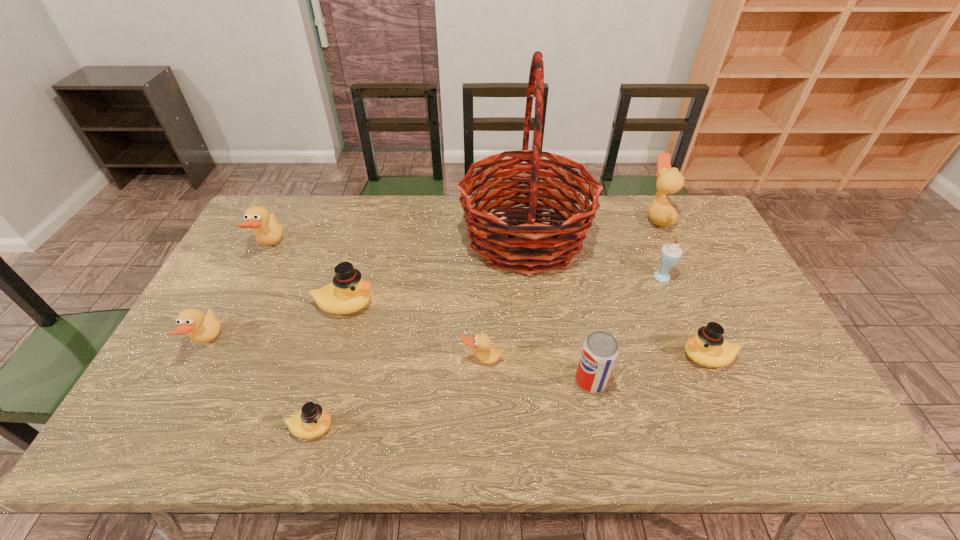
At what (x,y) coordinates should I click in order to perform the action: click on free space located 0.080m on the front-facing side of the nearest object. Please return your answer as a coordinate pair (x, y). Looking at the image, I should click on (370, 427).

Where is `basket at the far edge`? This screenshot has width=960, height=540. basket at the far edge is located at coordinates (535, 247).

You are a GUI agent. You are given a task and a screenshot of the screen. Output one action in this format:
    pyautogui.click(x=<x>, y=<y>)
    Task: Click on the object present at the near edge
    Image resolution: width=960 pixels, height=540 pixels.
    Given the screenshot: What is the action you would take?
    pyautogui.click(x=311, y=422)

The width and height of the screenshot is (960, 540). I want to click on object positioned at the far left corner, so click(264, 225).

Where is `object located in the far right corner section of the desktop`? This screenshot has width=960, height=540. object located in the far right corner section of the desktop is located at coordinates [x=669, y=180].

What are the coordinates of `vacant space at the far edge` in the screenshot? It's located at (659, 234).

Where is `free space at the near edge of the desktop`? Image resolution: width=960 pixels, height=540 pixels. free space at the near edge of the desktop is located at coordinates (472, 449).

This screenshot has width=960, height=540. What are the coordinates of `vacant area at the left edge of the desktop` in the screenshot? It's located at (244, 259).

Where is `vacant space at the right edge of the desktop`? The width and height of the screenshot is (960, 540). vacant space at the right edge of the desktop is located at coordinates (673, 238).

I want to click on vacant space at the far left corner of the desktop, so click(244, 235).